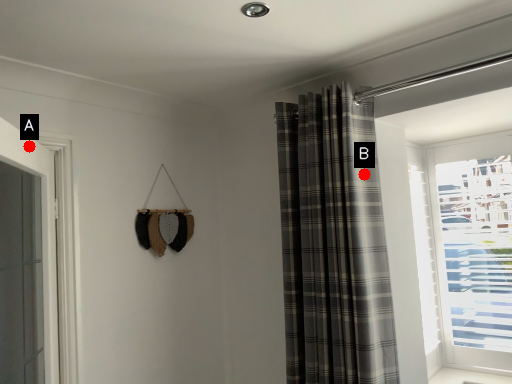
Question: Two points are circled on the image, labeled by A and B beside each circle. Which point is farther from the camera taking this photo?

Choices:
 (A) A is further
 (B) B is further

Answer: (B)